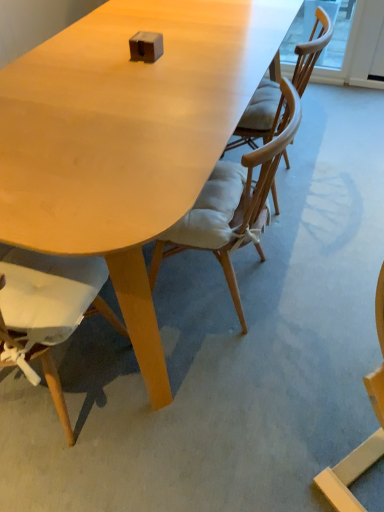
The image size is (384, 512). Find the location of `free space above matte wood table at center (from a real-world perspective)`. free space above matte wood table at center (from a real-world perspective) is located at coordinates (293, 268).